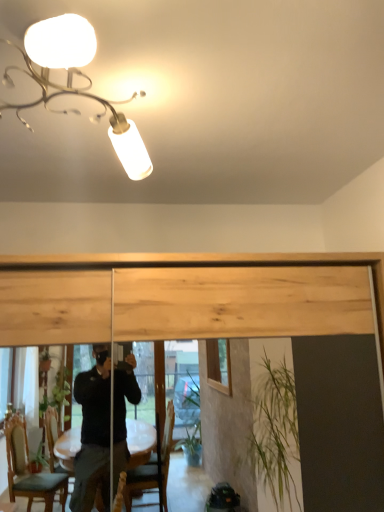
What do you see at coordinates (75, 87) in the screenshot?
I see `metallic chandelier at upper left` at bounding box center [75, 87].

Measure the distance between point (83, 21) and camera.

Point (83, 21) and camera are 32.28 inches apart.

At what (x,y) coordinates should I click in order to perform the action: click on metallic chandelier at upper left. Please return your answer as a coordinate pair (x, y). Image resolution: width=384 pixels, height=512 pixels. Looking at the image, I should click on (75, 87).

Find the location of `metallic chandelier at upper left`. metallic chandelier at upper left is located at coordinates (75, 87).